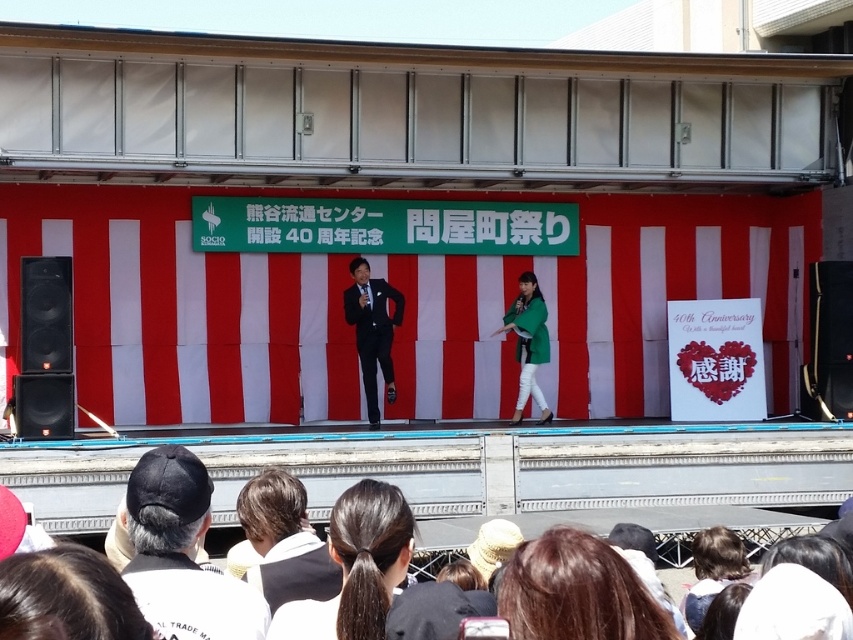
Is point (349, 605) behind point (514, 305)?

No, (349, 605) is in front of (514, 305).

Can you confirm if dark brown hair at center is positioned to the right of green matte jacket at center?

Incorrect, dark brown hair at center is not on the right side of green matte jacket at center.

Consider the image. Who is more distant from viewer, (300, 637) or (521, 276)?

Positioned behind is point (521, 276).

Locate an element on the screen. dark brown hair at center is located at coordinates (357, 566).

Between point (277, 625) and point (297, 544), which one is positioned in front?

Point (277, 625) is more forward.

Does dark brown hair at center come in front of brown leather jacket at lower center?

That is True.

The width and height of the screenshot is (853, 640). What are the coordinates of `dark brown hair at center` in the screenshot? It's located at (357, 566).

This screenshot has height=640, width=853. Describe the element at coordinates (183, 552) in the screenshot. I see `black fabric cap at lower left` at that location.

Which is in front, point (200, 541) or point (561, 545)?

Positioned in front is point (561, 545).

At what (x,y) coordinates should I click in order to perform the action: click on black fabric cap at lower left. Please return your answer as a coordinate pair (x, y). This screenshot has width=853, height=640. Looking at the image, I should click on (183, 552).